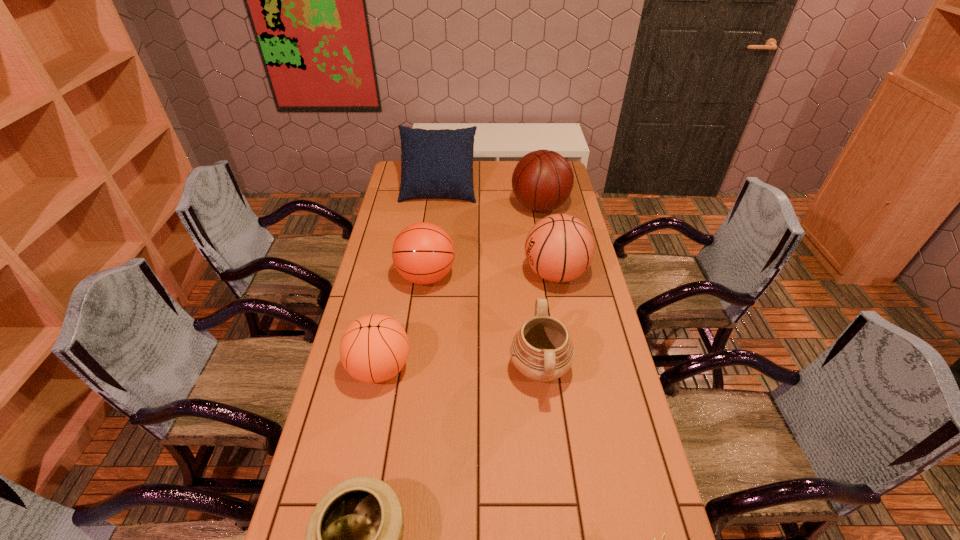
Find the location of a particular element. This screenshot has width=960, height=540. cushion is located at coordinates (434, 163).

I want to click on the farthest basketball, so click(x=542, y=180).

Find the location of a particular element. urn is located at coordinates (541, 350).

Locate an element on the screen. the shortest basketball is located at coordinates (374, 348).

Identify the location of free space located 0.340m on the facing side of the cushion. (431, 252).

Locate an element on the screen. This screenshot has width=960, height=540. vacant space located 0.070m on the back of the farthest basketball is located at coordinates (536, 183).

What are the coordinates of `free space located 0.400m on the front-facing side of the urn` in the screenshot? It's located at [378, 369].

Where is `vacant space positioned 0.300m on the front-facing side of the urn`? The height and width of the screenshot is (540, 960). vacant space positioned 0.300m on the front-facing side of the urn is located at coordinates (411, 369).

The height and width of the screenshot is (540, 960). In order to click on blank space located on the front-facing side of the urn in this screenshot , I will do `click(444, 369)`.

Find the location of a particular element. The height and width of the screenshot is (540, 960). free space located on the back of the nearest basketball is located at coordinates (397, 279).